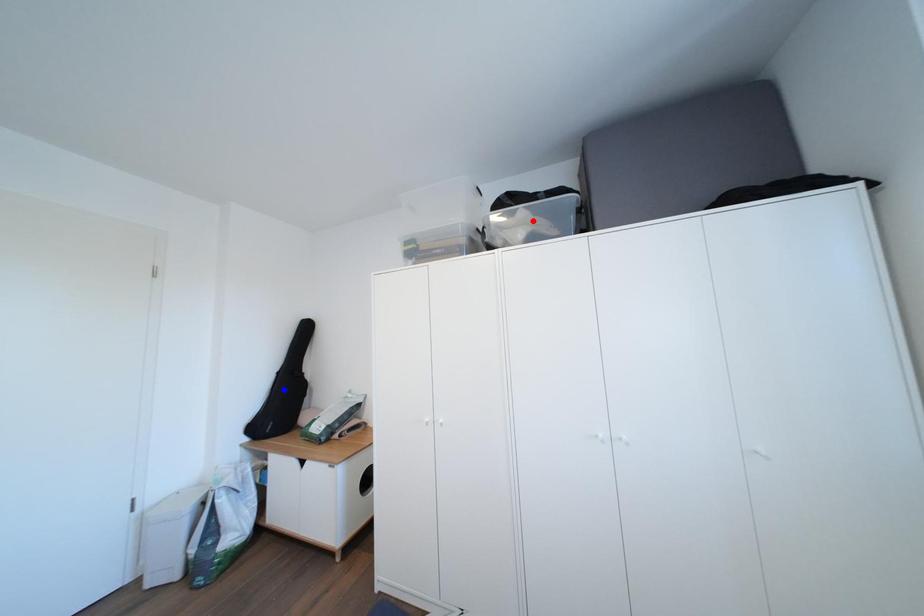
Question: Two points are marked on the image. Which point is closer to the camera?

Choices:
 (A) Blue point is closer.
 (B) Red point is closer.

Answer: (B)